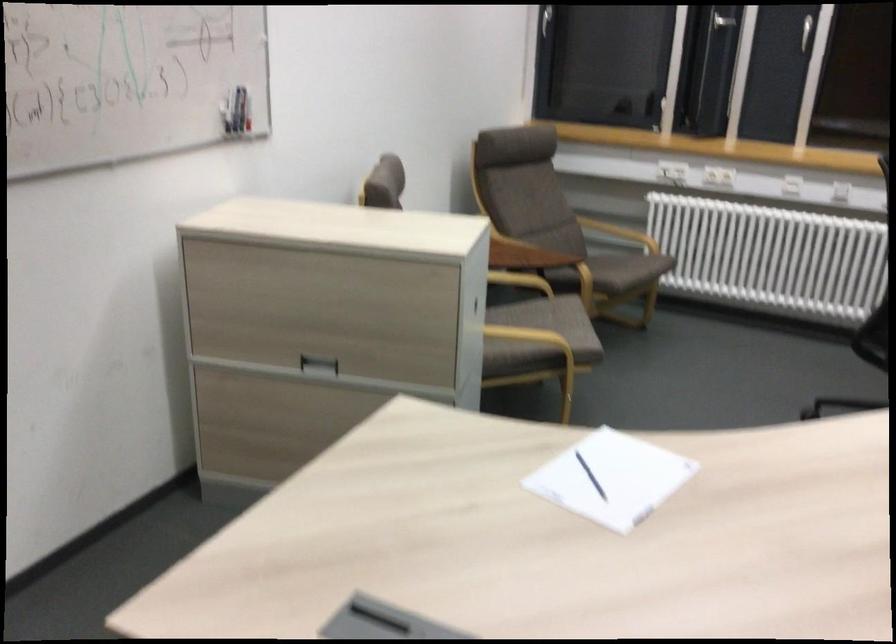
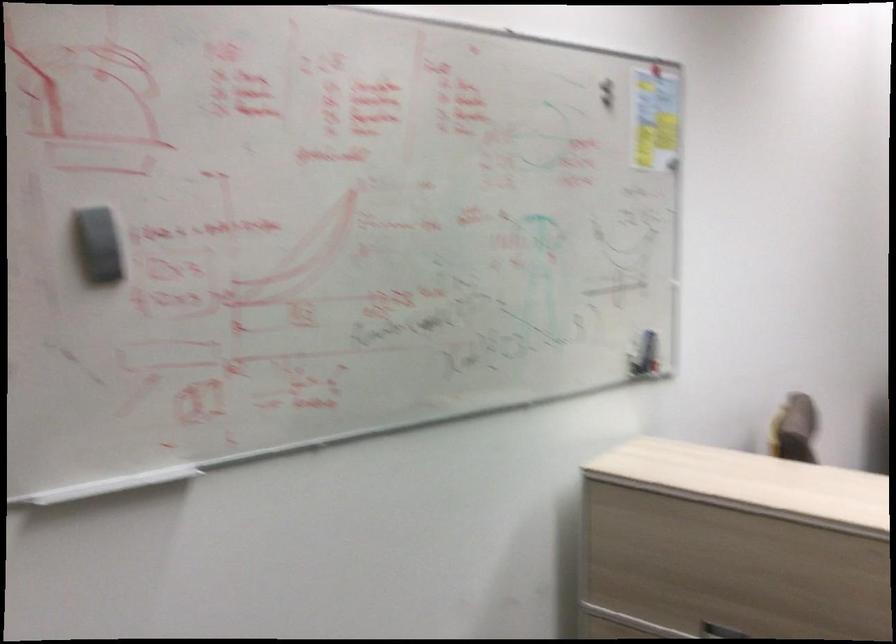
Which direction would the cameraman need to move to produce the second image?

The cameraman moved toward left, forward.